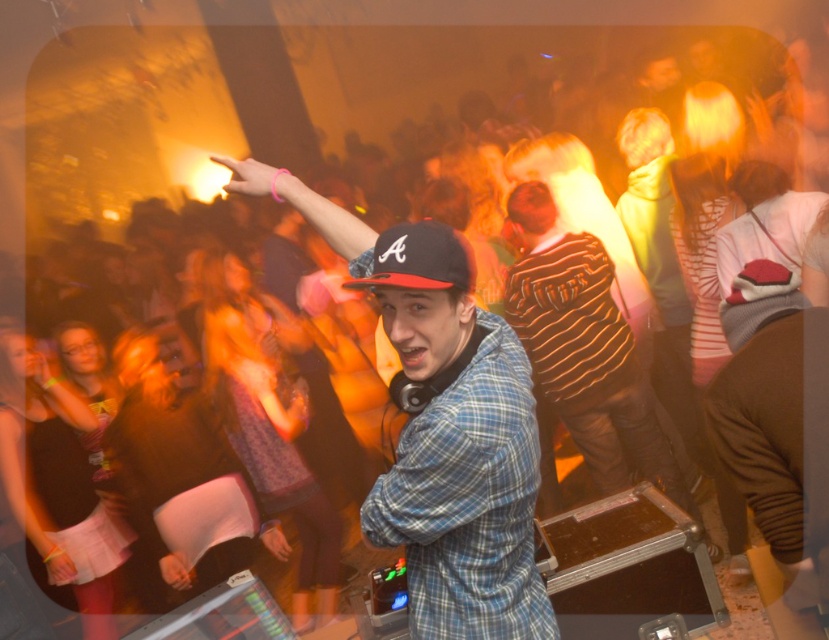
Question: Which point is farther from the camera taking this photo?

Choices:
 (A) (534, 410)
 (B) (444, 278)

Answer: (A)

Question: Does blue plaid shirt at center appear under black matte baseball cap at center?

Choices:
 (A) yes
 (B) no

Answer: (A)

Question: Which point is farther to the camera?

Choices:
 (A) click(348, 280)
 (B) click(410, 355)

Answer: (A)

Question: Is blue plaid shirt at center smaller than black matte baseball cap at center?

Choices:
 (A) no
 (B) yes

Answer: (A)

Question: Is blue plaid shirt at center wider than black matte baseball cap at center?

Choices:
 (A) yes
 (B) no

Answer: (A)